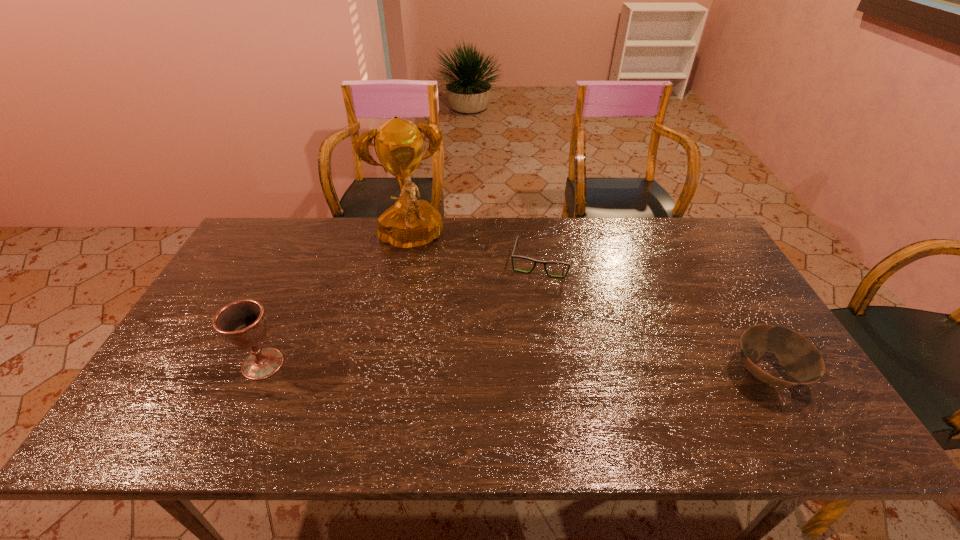
I want to click on vacant space situated 0.220m on the front side of the tallest object, so click(431, 318).

Where is `vacant space located on the front side of the tallest object`? This screenshot has height=540, width=960. vacant space located on the front side of the tallest object is located at coordinates (434, 329).

At what (x,y) coordinates should I click in order to perform the action: click on free spot located 0.160m on the front side of the tallest object. Please return your answer as a coordinate pair (x, y). The image size is (960, 540). Looking at the image, I should click on (427, 303).

The image size is (960, 540). In order to click on vacant position located on the lens of the third object from left to right in this screenshot , I will do `click(528, 322)`.

Identify the location of free space located 0.300m on the lens of the third object from left to right. This screenshot has height=540, width=960. (520, 356).

The image size is (960, 540). In order to click on blank space located on the lens of the third object from left to right in this screenshot , I will do `click(530, 312)`.

I want to click on award that is at the far edge, so click(x=410, y=224).

Image resolution: width=960 pixels, height=540 pixels. In order to click on spectacles that is at the far edge in this screenshot , I will do `click(513, 256)`.

Where is `chalice at the near edge`? This screenshot has width=960, height=540. chalice at the near edge is located at coordinates (243, 324).

At what (x,y) coordinates should I click in order to perform the action: click on bowl located in the near edge section of the desktop. Please return your answer as a coordinate pair (x, y). The width and height of the screenshot is (960, 540). Looking at the image, I should click on (799, 357).